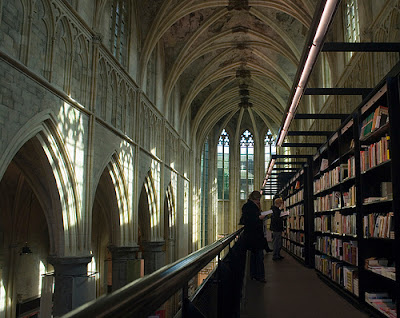
Where is `pillars`? pillars is located at coordinates (80, 286), (132, 267), (157, 252), (211, 220), (232, 220), (259, 176).